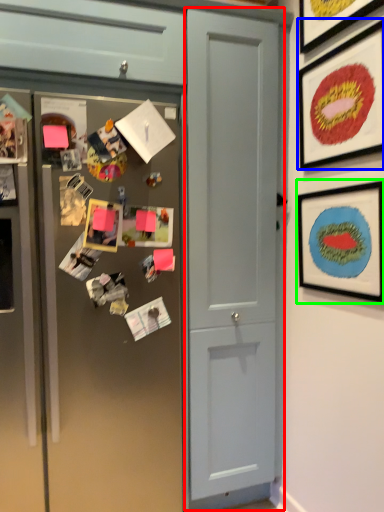
Question: Estimate the real-world distances between objects in this image. Which object is farther from door (highlighted by a red box), picture frame (highlighted by a blue box) or picture frame (highlighted by a green box)?

Choices:
 (A) picture frame
 (B) picture frame

Answer: (A)